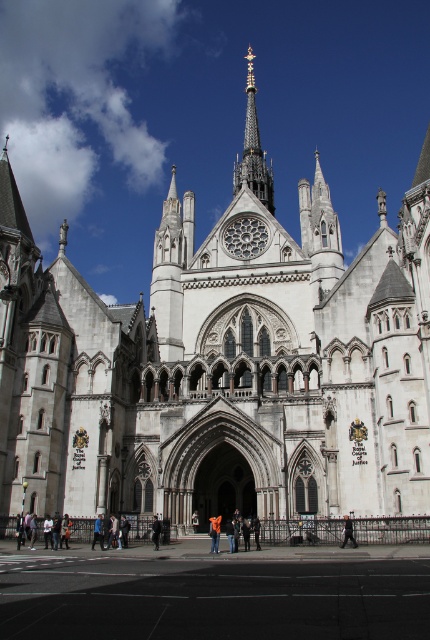
You are a photographer standing in front of the Royal Courts of Justice in London. You notice a dark gray jacket at center and a black fabric person at center in your frame. Which object appears narrower in your photo?

The dark gray jacket at center appears narrower because its width is less than the black fabric person at center.

You are standing in front of the Royal Courts of Justice in London. You notice the polished steel spire at upper center. If you were to draw a straight line from your eye level to the base of the spire, would this line intersect the statue of Lady Justice located at the front entrance?

The question cannot be answered with the provided information because the description does not mention the presence of a statue of Lady Justice or its location relative to the polished steel spire at upper center.

In the scene shown: You are an architect examining the Royal Courts of Justice building. You notice a specific point at coordinates point (252, 150). What architectural feature is located at this point?

The point (252, 150) indicates the location of the polished steel spire at upper center.